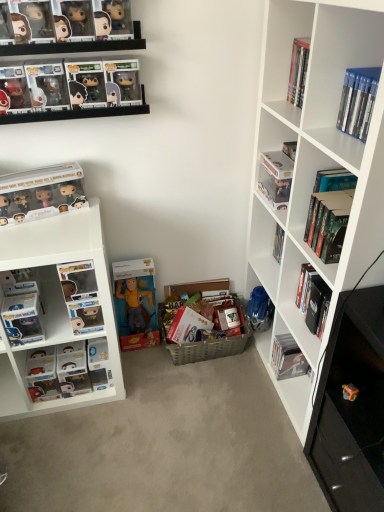
Question: Considering the relative positions of hardcover book at upper right, the first book when ordered from right to left, and matte plastic pop vinyl figure at lower left, placed as the 7th book when sorted from right to left, in the image provided, is hardcover book at upper right, the first book when ordered from right to left, to the left of matte plastic pop vinyl figure at lower left, placed as the 7th book when sorted from right to left, from the viewer's perspective?

Choices:
 (A) yes
 (B) no

Answer: (B)

Question: Considering the relative sizes of hardcover book at upper right, the first book when ordered from right to left, and matte plastic pop vinyl figure at lower left, the second book from the left, in the image provided, is hardcover book at upper right, the first book when ordered from right to left, wider than matte plastic pop vinyl figure at lower left, the second book from the left,?

Choices:
 (A) no
 (B) yes

Answer: (A)

Question: From a real-world perspective, is hardcover book at upper right, which ranks as the 8th book in left-to-right order, positioned over matte plastic pop vinyl figure at lower left, the second book from the left, based on gravity?

Choices:
 (A) no
 (B) yes

Answer: (B)

Question: Can you confirm if hardcover book at upper right, which ranks as the 8th book in left-to-right order, is bigger than matte plastic pop vinyl figure at lower left, the second book from the left?

Choices:
 (A) yes
 (B) no

Answer: (B)

Question: From a real-world perspective, is hardcover book at upper right, which ranks as the 8th book in left-to-right order, located beneath matte plastic pop vinyl figure at lower left, the second book from the left?

Choices:
 (A) no
 (B) yes

Answer: (A)

Question: Can you confirm if hardcover book at upper right, which ranks as the 8th book in left-to-right order, is shorter than matte plastic pop vinyl figure at lower left, the second book from the left?

Choices:
 (A) no
 (B) yes

Answer: (B)

Question: Are matte plastic pop vinyl figure at lower left, the second book from the left, and matte plastic pop vinyl figure at upper right, which is counted as the sixth book, starting from the right, far apart?

Choices:
 (A) yes
 (B) no

Answer: (A)

Question: Considering the relative sizes of matte plastic pop vinyl figure at lower left, the second book from the left, and matte plastic pop vinyl figure at upper right, which is counted as the sixth book, starting from the right, in the image provided, is matte plastic pop vinyl figure at lower left, the second book from the left, taller than matte plastic pop vinyl figure at upper right, which is counted as the sixth book, starting from the right,?

Choices:
 (A) no
 (B) yes

Answer: (B)

Question: Is matte plastic pop vinyl figure at lower left, placed as the 7th book when sorted from right to left, bigger than matte plastic pop vinyl figure at upper right, which is counted as the sixth book, starting from the right?

Choices:
 (A) no
 (B) yes

Answer: (B)

Question: Is matte plastic pop vinyl figure at lower left, the second book from the left, positioned in front of matte plastic pop vinyl figure at upper right, placed as the 3th book when sorted from left to right?

Choices:
 (A) yes
 (B) no

Answer: (B)

Question: Is matte plastic pop vinyl figure at lower left, placed as the 7th book when sorted from right to left, positioned with its back to matte plastic pop vinyl figure at upper right, placed as the 3th book when sorted from left to right?

Choices:
 (A) no
 (B) yes

Answer: (A)

Question: From the image's perspective, would you say matte plastic pop vinyl figure at lower left, placed as the 7th book when sorted from right to left, is shown under matte plastic pop vinyl figure at upper right, which is counted as the sixth book, starting from the right?

Choices:
 (A) yes
 (B) no

Answer: (A)

Question: Does matte black pop vinyl figures at upper left, the eighth book when ordered from right to left, have a smaller size compared to hardcover book at upper right, acting as the fourth book starting from the left?

Choices:
 (A) yes
 (B) no

Answer: (B)